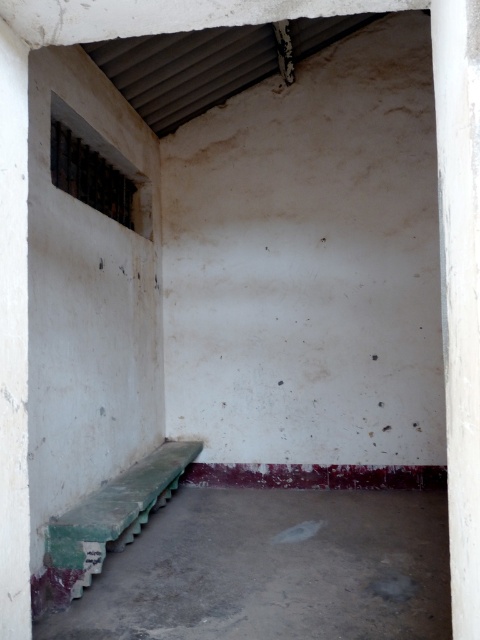
You are standing in the room and want to move from the white concrete pillar at left to the green painted wood bench at lower left. Which direction should you move to reach the bench?

The white concrete pillar at left is to the left of the green painted wood bench at lower left, so you should move to the right to reach the bench.

You are standing in the room and want to move from the point at coordinates (118, 513) to the point at (444, 333). Can you walk directly between these two points without any obstacles?

Point (444, 333) is behind point (118, 513), so you cannot walk directly between them without passing through the latter first.

You are standing in the middle of the room and want to move to the window on the left. Which pillar, the white smooth pillar at right or the white concrete pillar at left, is closer to your starting position?

The white concrete pillar at left is closer to your starting position because you are in the middle of the room and it is on the left side, while the white smooth pillar at right is further away on the right side.